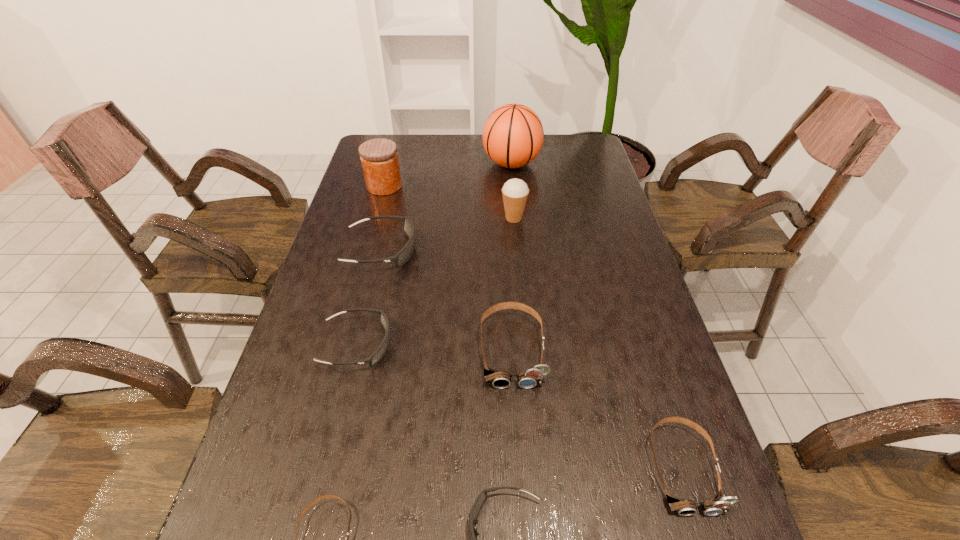
Identify which object is the closest to the icecream. Please provide its 2D coordinates. Your answer should be formatted as a tuple, i.e. [(x, y)], where the tuple contains the x and y coordinates of a point satisfying the conditions above.

[(513, 135)]

Locate which goggles is the third closest to the basketball. Please provide its 2D coordinates. Your answer should be formatted as a tuple, i.e. [(x, y)], where the tuple contains the x and y coordinates of a point satisfying the conditions above.

[(383, 319)]

Locate which goggles ranks third in proximity to the leftmost brown goggles. Please provide its 2D coordinates. Your answer should be formatted as a tuple, i.e. [(x, y)], where the tuple contains the x and y coordinates of a point satisfying the conditions above.

[(499, 379)]

I want to click on black goggles that stands as the closest to the sixth nearest object, so click(383, 319).

Identify the location of black goggles that is the second closest to the farthest black goggles. (482, 497).

Identify the location of brown goggles that is the closest to the orange jar. (499, 379).

Where is `brown goggles that stands as the closest to the smallest brown goggles`? brown goggles that stands as the closest to the smallest brown goggles is located at coordinates (x=499, y=379).